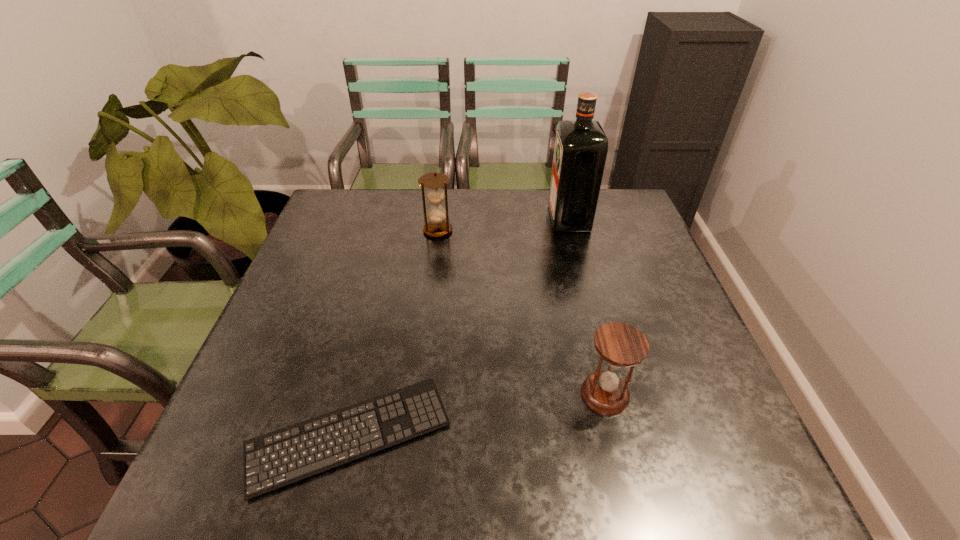
Where is `the tallest object`? The image size is (960, 540). the tallest object is located at coordinates (581, 146).

Locate an element on the screen. This screenshot has height=540, width=960. the left hourglass is located at coordinates (437, 227).

The height and width of the screenshot is (540, 960). I want to click on the nearer hourglass, so click(x=621, y=345).

You are a GUI agent. You are given a task and a screenshot of the screen. Output one action in this format:
    pyautogui.click(x=<x>, y=<y>)
    Task: Click on the computer keyboard
    
    Given the screenshot: What is the action you would take?
    pyautogui.click(x=273, y=460)

Image resolution: width=960 pixels, height=540 pixels. Find the location of `free point located 0.180m on the front label of the liquor`. free point located 0.180m on the front label of the liquor is located at coordinates (492, 219).

Find the location of `vacant area located on the front label of the liquor`. vacant area located on the front label of the liquor is located at coordinates (495, 219).

Identify the location of blank area located 0.300m on the front label of the liquor. The width and height of the screenshot is (960, 540). (453, 219).

Where is `vacant space positioned on the front of the farther hourglass`? vacant space positioned on the front of the farther hourglass is located at coordinates (426, 327).

This screenshot has width=960, height=540. I want to click on free space located on the front of the nearer hourglass, so click(624, 471).

You are a GUI agent. You are given a task and a screenshot of the screen. Output one action in this format:
    pyautogui.click(x=<x>, y=<y>)
    Task: Click on the vacant space located on the back of the computer keyboard
    This screenshot has height=540, width=960.
    Given the screenshot: What is the action you would take?
    pyautogui.click(x=380, y=303)